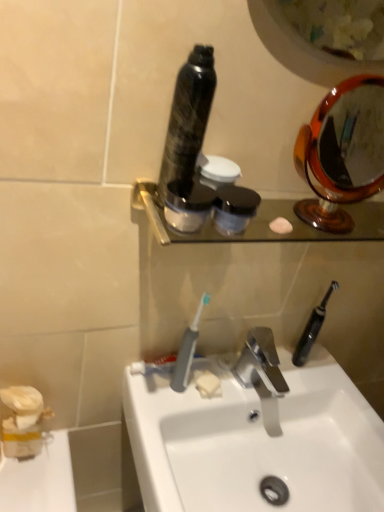
Question: Does point (276, 425) appear closer or farther from the camera than point (188, 224)?

Choices:
 (A) farther
 (B) closer

Answer: (A)

Question: In the image, is polished chrome faucet at center positioned in front of or behind satin black bottle at center, the 2th mouthwash when ordered from bottom to top?

Choices:
 (A) front
 (B) behind

Answer: (B)

Question: Which of these objects is positioned closest to the white glossy sink at center?

Choices:
 (A) white matte soap at center
 (B) gray plastic toothbrush at center, the 2th toothbrush positioned from the right
 (C) black plastic toothbrush at right, the first toothbrush in the back-to-front sequence
 (D) satin black bottle at center, the 2th mouthwash when ordered from bottom to top
 (E) polished chrome faucet at center

Answer: (E)

Question: Estimate the real-world distances between objects in this image. Which object is closer to the white glossy sink at center?

Choices:
 (A) white matte soap at center
 (B) gray plastic toothbrush at center, the 1th toothbrush from the front
 (C) satin black bottle at center, acting as the 2th mouthwash starting from the top
 (D) black matte jar at center, the first mouthwash from the bottom
 (E) shiny black bottle at center, the 1th mouthwash positioned from the top

Answer: (A)